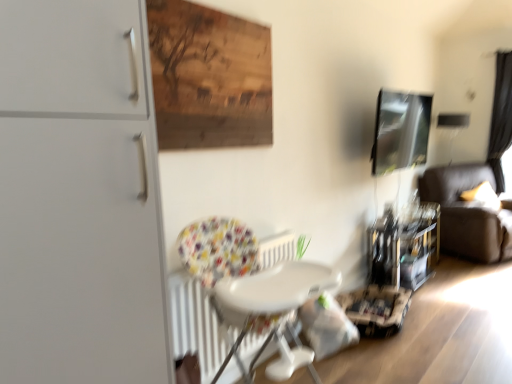
Question: In terms of size, does dark brown leather couch at right appear bigger or smaller than metallic glossy picture frame at upper right?

Choices:
 (A) small
 (B) big

Answer: (B)

Question: From a real-world perspective, is dark brown leather couch at right above or below metallic glossy picture frame at upper right?

Choices:
 (A) below
 (B) above

Answer: (A)

Question: Based on their relative distances, which object is farther from the white plastic chair at center?

Choices:
 (A) matte white cabinet at left
 (B) dark brown leather couch at right
 (C) black fabric curtain at right
 (D) metallic glossy picture frame at upper right
 (E) wooden panel at upper center

Answer: (C)

Question: Estimate the real-world distances between objects in this image. Which object is closer to the metallic glossy picture frame at upper right?

Choices:
 (A) matte white cabinet at left
 (B) black fabric curtain at right
 (C) white plastic chair at center
 (D) wooden panel at upper center
 (E) dark brown leather couch at right

Answer: (E)